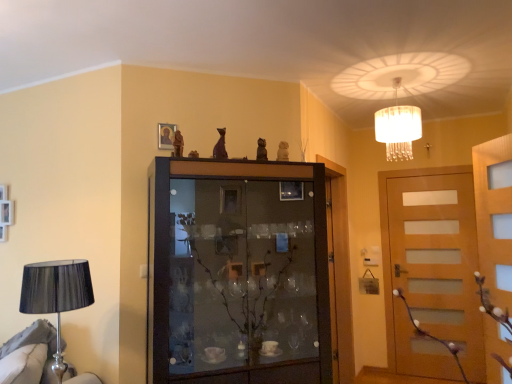
Question: Does light brown wood door at right, placed as the 2th door when sorted from left to right, appear on the right side of translucent glass chandelier at upper center?

Choices:
 (A) no
 (B) yes

Answer: (B)

Question: From a real-world perspective, is light brown wood door at right, marked as the 1th door in a right-to-left arrangement, on top of translucent glass chandelier at upper center?

Choices:
 (A) no
 (B) yes

Answer: (A)

Question: Is light brown wood door at right, marked as the 1th door in a right-to-left arrangement, far from translucent glass chandelier at upper center?

Choices:
 (A) no
 (B) yes

Answer: (B)

Question: Does light brown wood door at right, marked as the 1th door in a right-to-left arrangement, have a lesser height compared to translucent glass chandelier at upper center?

Choices:
 (A) no
 (B) yes

Answer: (A)

Question: From the image's perspective, is light brown wood door at right, marked as the 1th door in a right-to-left arrangement, over translucent glass chandelier at upper center?

Choices:
 (A) yes
 (B) no

Answer: (B)

Question: From a real-world perspective, is light brown wood door at right, placed as the 2th door when sorted from left to right, beneath translucent glass chandelier at upper center?

Choices:
 (A) no
 (B) yes

Answer: (B)

Question: From a real-world perspective, is matte gold picture frame at upper center under light brown wood door at right, placed as the 2th door when sorted from left to right?

Choices:
 (A) yes
 (B) no

Answer: (B)

Question: Considering the relative positions of matte gold picture frame at upper center and light brown wood door at right, marked as the 1th door in a right-to-left arrangement, in the image provided, is matte gold picture frame at upper center behind light brown wood door at right, marked as the 1th door in a right-to-left arrangement,?

Choices:
 (A) no
 (B) yes

Answer: (A)

Question: Is matte gold picture frame at upper center facing away from light brown wood door at right, placed as the 2th door when sorted from left to right?

Choices:
 (A) yes
 (B) no

Answer: (B)

Question: Is matte gold picture frame at upper center smaller than light brown wood door at right, placed as the 2th door when sorted from left to right?

Choices:
 (A) no
 (B) yes

Answer: (B)

Question: Is matte gold picture frame at upper center to the right of light brown wood door at right, marked as the 1th door in a right-to-left arrangement, from the viewer's perspective?

Choices:
 (A) no
 (B) yes

Answer: (A)

Question: Is matte gold picture frame at upper center closer to camera compared to light brown wood door at right, marked as the 1th door in a right-to-left arrangement?

Choices:
 (A) yes
 (B) no

Answer: (A)

Question: Does wooden door at center, positioned as the 1th door in left-to-right order, have a greater height compared to translucent glass chandelier at upper center?

Choices:
 (A) yes
 (B) no

Answer: (A)